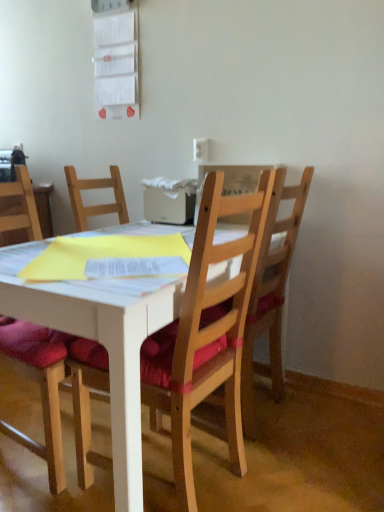
Question: In the image, is wooden chair at right, the 1th chair in the right-to-left sequence, on the left side or the right side of wooden chair at center, the 2th chair from the left?

Choices:
 (A) right
 (B) left

Answer: (A)

Question: From the image's perspective, relative to wooden chair at center, the 2th chair from the left, is wooden chair at right, the 1th chair in the right-to-left sequence, above or below?

Choices:
 (A) above
 (B) below

Answer: (A)

Question: Estimate the real-world distances between objects in this image. Which object is farther from the wooden chair with red cushion at left, placed as the 1th chair when sorted from left to right?

Choices:
 (A) wooden chair at right, placed as the third chair when sorted from left to right
 (B) wooden chair at center, the 2th chair positioned from the right
 (C) white plastic power outlet at upper center

Answer: (C)

Question: Which of these objects is positioned farthest from the wooden chair at center, the 2th chair from the left?

Choices:
 (A) wooden chair at right, the 1th chair in the right-to-left sequence
 (B) wooden chair with red cushion at left, placed as the 1th chair when sorted from left to right
 (C) white plastic power outlet at upper center

Answer: (C)